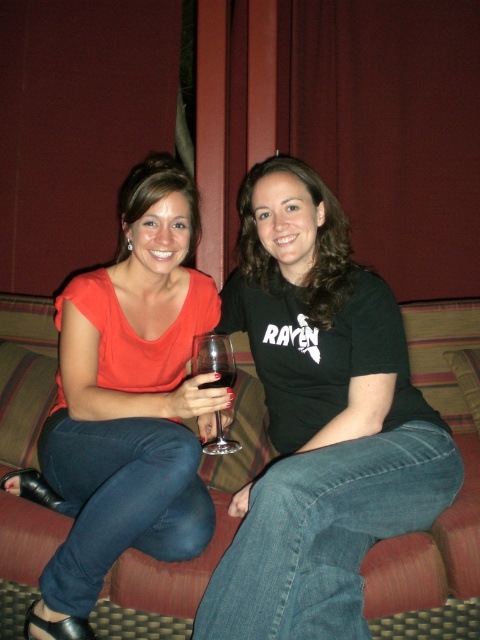
Question: Can you confirm if matte orange blouse at center is bigger than textured fabric couch at center?

Choices:
 (A) yes
 (B) no

Answer: (B)

Question: Which object is positioned closest to the clear glass wine glass at center?

Choices:
 (A) clear glass wine at center
 (B) black matte shirt at center

Answer: (A)

Question: In this image, where is textured fabric couch at center located relative to clear glass wine glass at center?

Choices:
 (A) right
 (B) left

Answer: (B)

Question: Which object is closer to the camera taking this photo?

Choices:
 (A) matte orange blouse at center
 (B) textured fabric couch at center

Answer: (A)

Question: Can you confirm if black matte shirt at center is positioned to the right of textured fabric couch at center?

Choices:
 (A) yes
 (B) no

Answer: (A)

Question: Which object appears closest to the camera in this image?

Choices:
 (A) clear glass wine at center
 (B) black matte shirt at center
 (C) textured fabric couch at center
 (D) matte orange blouse at center

Answer: (B)